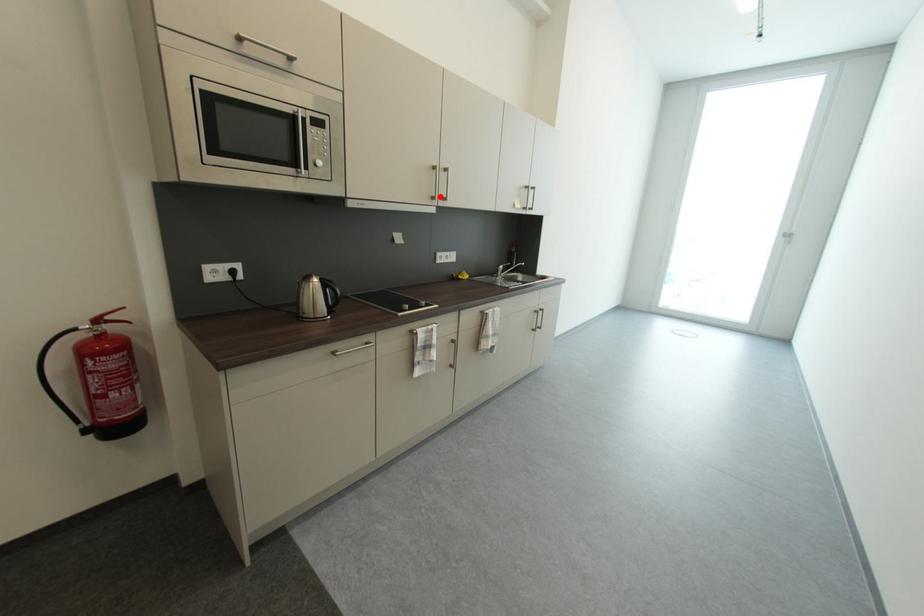
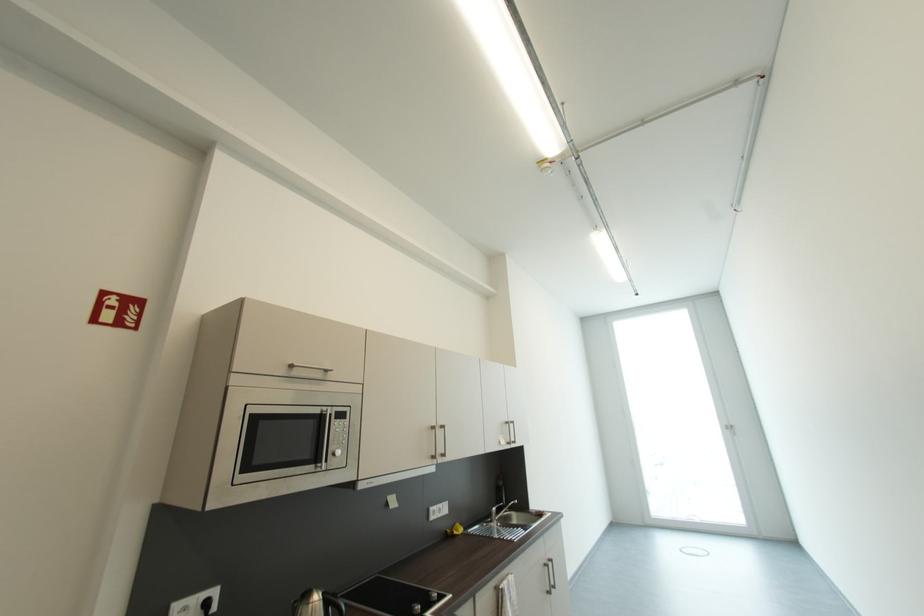
Find the pixel in the second image that matches the highlighted location in the first image.

(440, 456)